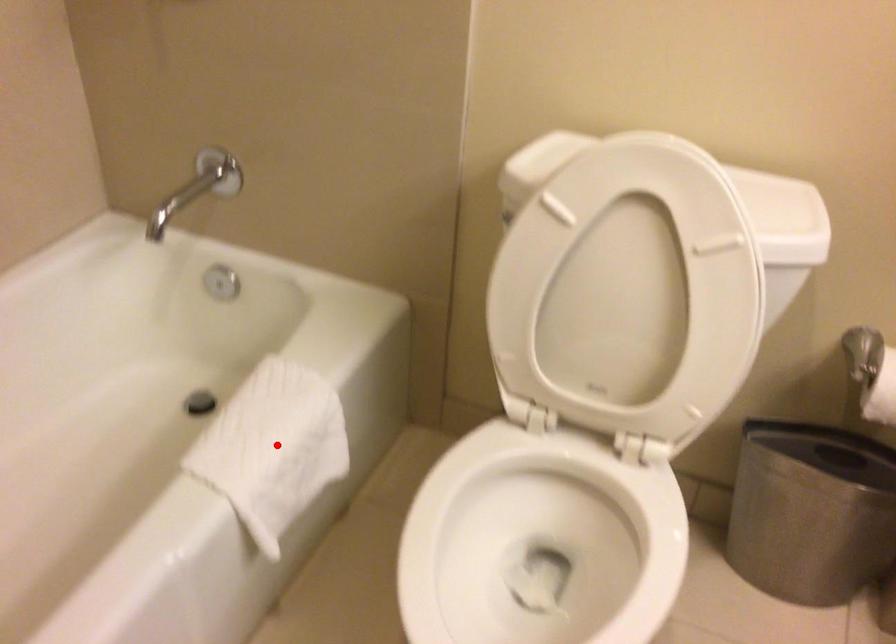
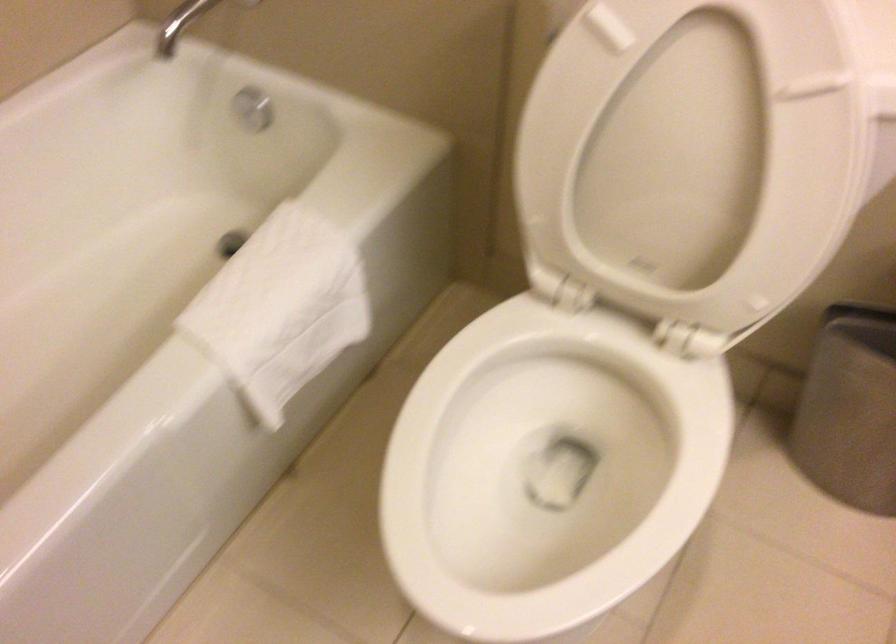
Where in the second image is the point corresponding to the highlighted location from the first image?

(282, 303)